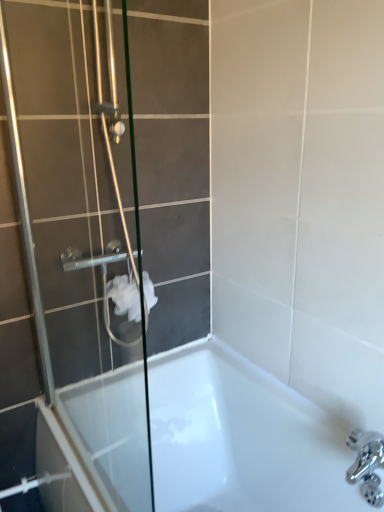
At what (x,y) coordinates should I click in order to perform the action: click on free region under clear glass shower door at left (from a real-world perspective). Please return your answer as a coordinate pair (x, y). The image size is (384, 512). Looking at the image, I should click on (73, 454).